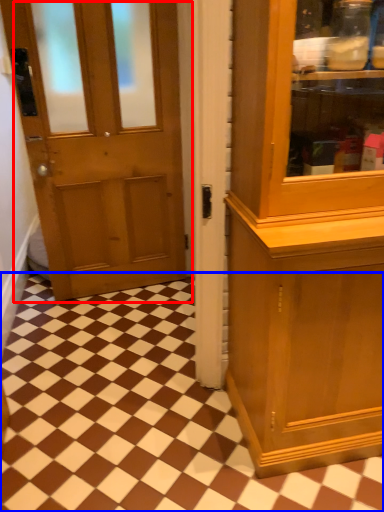
Question: Which object appears farthest to the camera in this image, door (highlighted by a red box) or tile (highlighted by a blue box)?

Choices:
 (A) door
 (B) tile

Answer: (B)